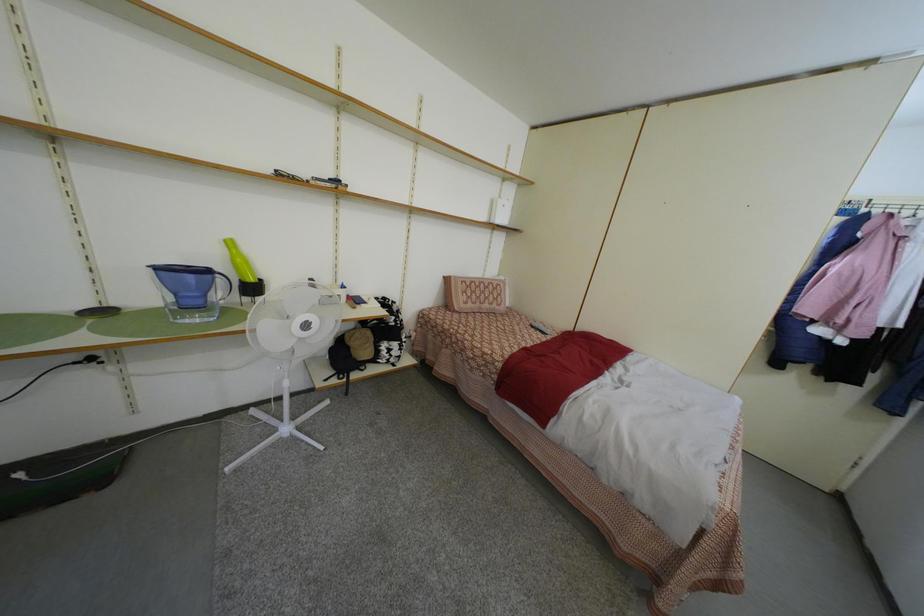
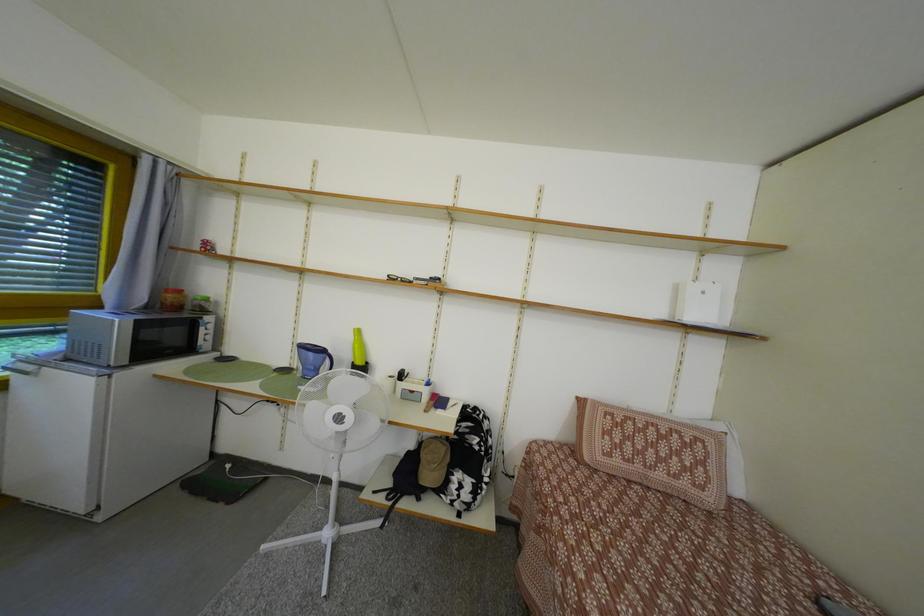
Based on the continuous images, in which direction is the camera rotating?

The rotation direction of the camera is left-up.